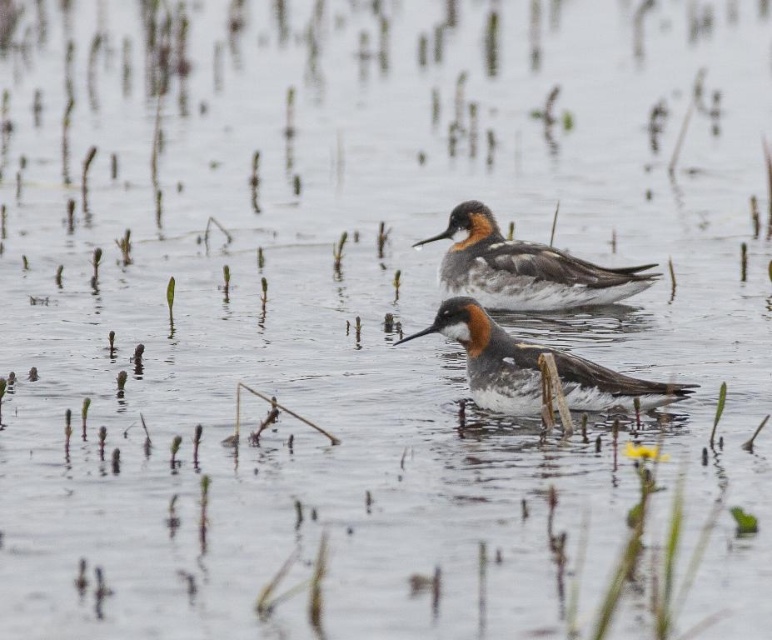
Question: Which object is farther from the camera taking this photo?

Choices:
 (A) brown speckled feathers at center
 (B) brown speckled duck at center

Answer: (B)

Question: Which point appears farthest from the camera in this image?

Choices:
 (A) (469, 204)
 (B) (479, 349)

Answer: (A)

Question: Which point is farther to the camera?

Choices:
 (A) brown speckled duck at center
 (B) brown speckled feathers at center

Answer: (A)

Question: Does brown speckled duck at center have a smaller size compared to brown speckled feathers at center?

Choices:
 (A) yes
 (B) no

Answer: (B)

Question: Observing the image, what is the correct spatial positioning of brown speckled duck at center in reference to brown speckled feathers at center?

Choices:
 (A) below
 (B) above

Answer: (B)

Question: Is brown speckled duck at center bigger than brown speckled feathers at center?

Choices:
 (A) no
 (B) yes

Answer: (B)